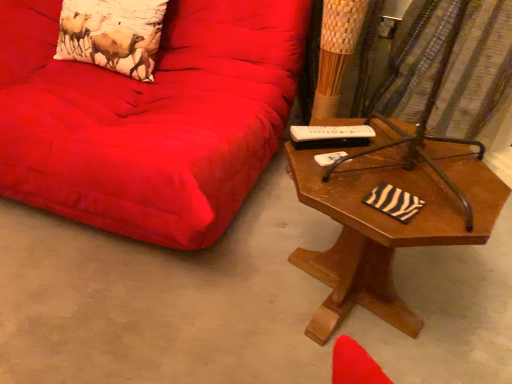
Question: From a real-world perspective, does brown wooden table at right sit lower than brown metal swivel chair at right?

Choices:
 (A) yes
 (B) no

Answer: (A)

Question: From the image's perspective, is brown wooden table at right on top of brown metal swivel chair at right?

Choices:
 (A) no
 (B) yes

Answer: (A)

Question: Can you confirm if brown wooden table at right is thinner than brown metal swivel chair at right?

Choices:
 (A) no
 (B) yes

Answer: (A)

Question: Does brown wooden table at right have a smaller size compared to brown metal swivel chair at right?

Choices:
 (A) no
 (B) yes

Answer: (A)

Question: Does brown wooden table at right have a larger size compared to brown metal swivel chair at right?

Choices:
 (A) yes
 (B) no

Answer: (A)

Question: From a real-world perspective, is brown metal swivel chair at right positioned above or below suede red couch at upper left?

Choices:
 (A) above
 (B) below

Answer: (B)

Question: Would you say brown metal swivel chair at right is to the left or to the right of suede red couch at upper left in the picture?

Choices:
 (A) left
 (B) right

Answer: (B)

Question: In terms of size, does brown metal swivel chair at right appear bigger or smaller than suede red couch at upper left?

Choices:
 (A) small
 (B) big

Answer: (A)

Question: Does point (461, 1) appear closer or farther from the camera than point (103, 145)?

Choices:
 (A) farther
 (B) closer

Answer: (A)

Question: From a real-world perspective, is printed fabric pillow at upper left positioned above or below brown metal swivel chair at right?

Choices:
 (A) above
 (B) below

Answer: (A)

Question: Visually, is printed fabric pillow at upper left positioned to the left or to the right of brown metal swivel chair at right?

Choices:
 (A) right
 (B) left

Answer: (B)

Question: Considering their positions, is printed fabric pillow at upper left located in front of or behind brown metal swivel chair at right?

Choices:
 (A) behind
 (B) front

Answer: (A)

Question: Which is correct: printed fabric pillow at upper left is inside brown metal swivel chair at right, or outside of it?

Choices:
 (A) inside
 (B) outside

Answer: (B)

Question: From the image's perspective, relative to brown metal swivel chair at right, is suede red couch at upper left above or below?

Choices:
 (A) below
 (B) above

Answer: (B)

Question: From a real-world perspective, is suede red couch at upper left above or below brown metal swivel chair at right?

Choices:
 (A) below
 (B) above

Answer: (B)